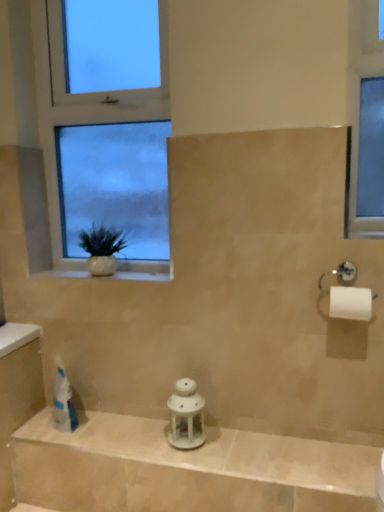
Where is `spots to the right of white porcelain lantern at center`? The width and height of the screenshot is (384, 512). spots to the right of white porcelain lantern at center is located at coordinates (246, 448).